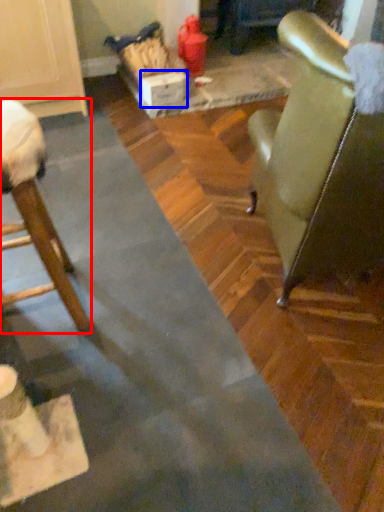
Question: Among these objects, which one is farthest to the camera, chair (highlighted by a red box) or cardboard box (highlighted by a blue box)?

Choices:
 (A) chair
 (B) cardboard box

Answer: (B)